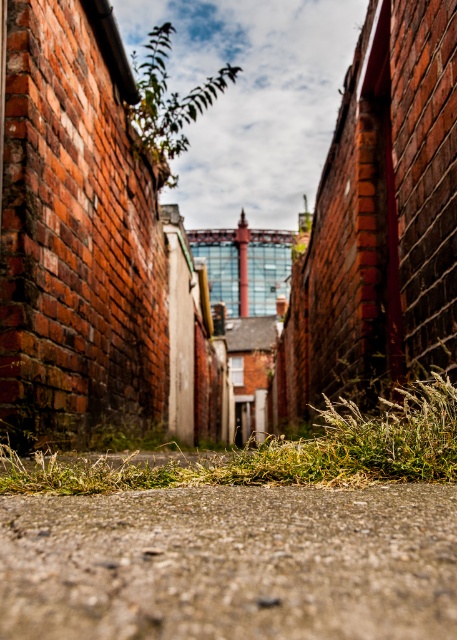
Question: Which point is closer to the camera taking this photo?

Choices:
 (A) (403, 396)
 (B) (410, 614)
 (C) (165, 81)

Answer: (B)

Question: Which of the following is the farthest from the observer?

Choices:
 (A) green leafy plant at upper center
 (B) green grass at bottom
 (C) gray concrete ground at center

Answer: (A)

Question: Can you confirm if gray concrete ground at center is wider than green grass at bottom?

Choices:
 (A) no
 (B) yes

Answer: (A)

Question: Is gray concrete ground at center to the left of green leafy plant at upper center from the viewer's perspective?

Choices:
 (A) yes
 (B) no

Answer: (B)

Question: Is gray concrete ground at center wider than green grass at bottom?

Choices:
 (A) yes
 (B) no

Answer: (B)

Question: Based on their relative distances, which object is nearer to the green leafy plant at upper center?

Choices:
 (A) gray concrete ground at center
 (B) green grass at bottom

Answer: (A)